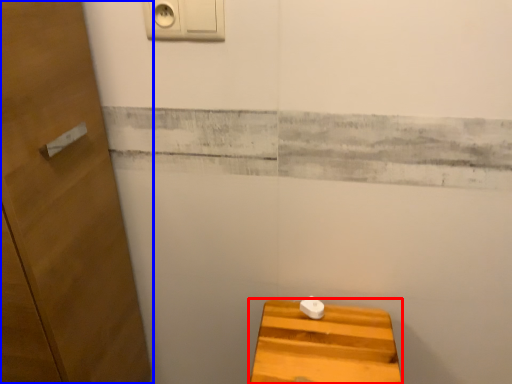
Question: Which of the following is the closest to the observer, furniture (highlighted by a red box) or door (highlighted by a blue box)?

Choices:
 (A) furniture
 (B) door

Answer: (B)